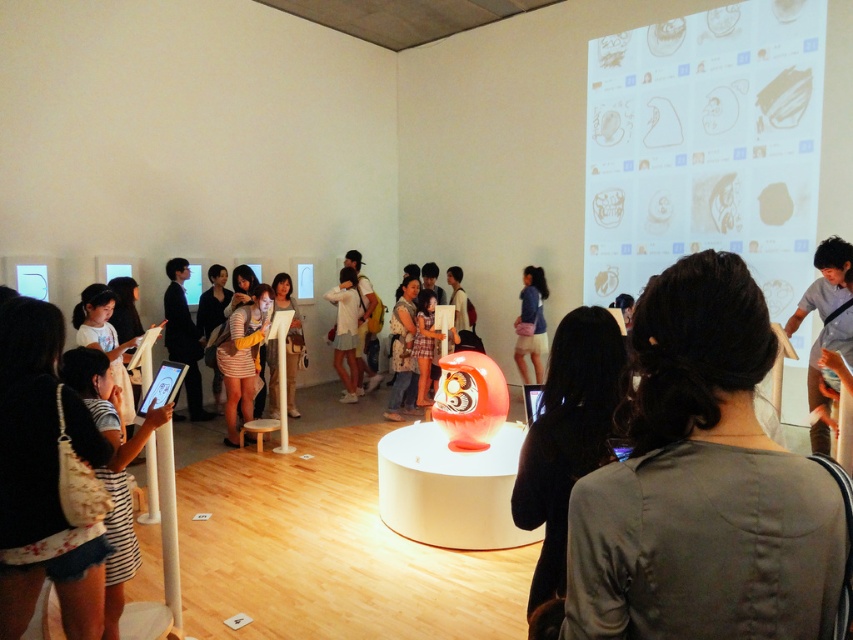
You are an event planner arranging seating for a presentation. You need to place a chair in the center of the room where both the dark blue suit at center and the matte black dress at center are visible. Will the chair be able to see both items clearly?

The dark blue suit at center is positioned over the matte black dress at center, so placing a chair in the center would allow clear visibility to both items as they are stacked vertically.

You are an event planner setting up for a fashion show in the exhibition space. You need to arrange two items from the image, the dark gray fabric at center and the striped fabric dress at center. Since both are at the center, how can you position them so they don not block each other?

The dark gray fabric at center is located above the striped fabric dress at center, so you can position the dark gray fabric above the striped fabric dress to avoid blocking each other.